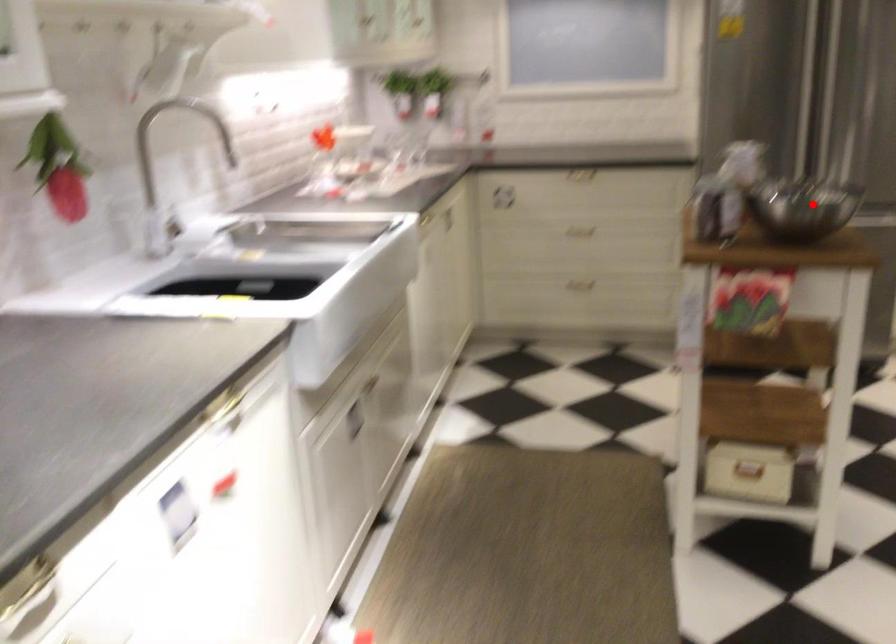
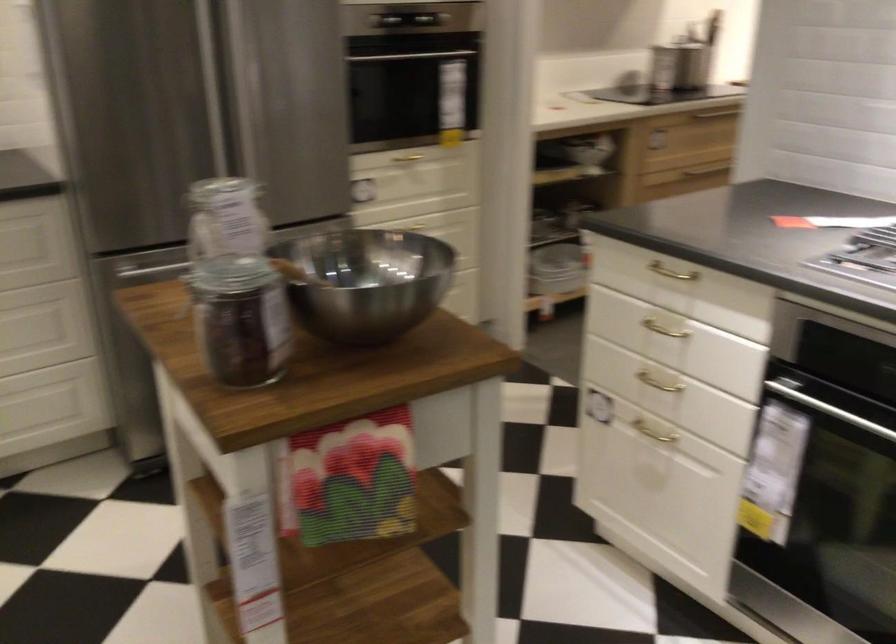
Question: A red point is marked in image1. In image2, is the corresponding 3D point closer to the camera or farther? Reply with the corresponding letter.

Choices:
 (A) The corresponding 3D point is closer.
 (B) The corresponding 3D point is farther.

Answer: (A)